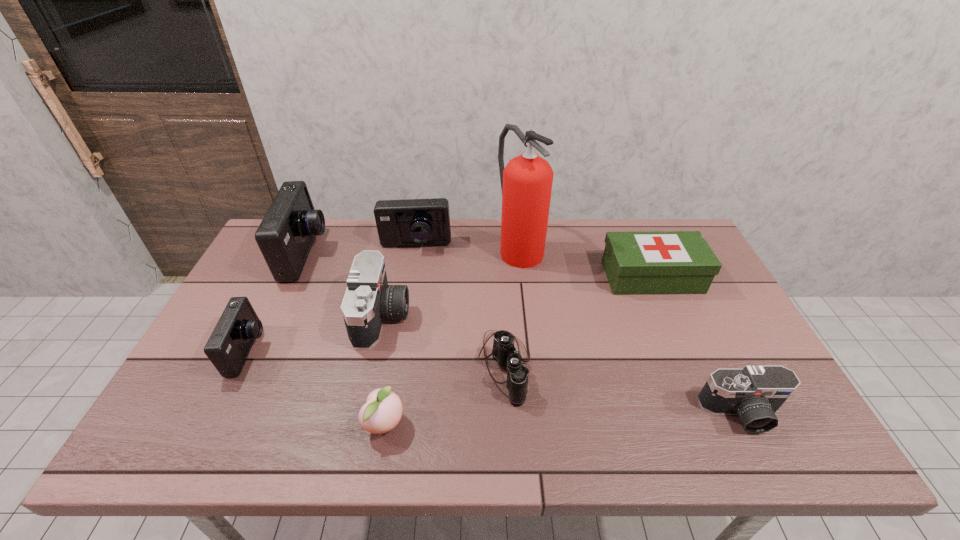
This screenshot has height=540, width=960. I want to click on free space located on the left of the pink peach, so click(x=325, y=423).

The height and width of the screenshot is (540, 960). What are the coordinates of `fire extinguisher that is at the far edge` in the screenshot? It's located at (526, 182).

At what (x,y) coordinates should I click in order to perform the action: click on the first-aid kit present at the far edge. Please return your answer as a coordinate pair (x, y). The width and height of the screenshot is (960, 540). Looking at the image, I should click on 657,262.

I want to click on camera that is at the near edge, so click(x=754, y=393).

This screenshot has width=960, height=540. In order to click on peach that is at the near edge in this screenshot , I will do `click(382, 411)`.

The width and height of the screenshot is (960, 540). What are the coordinates of `the first-aid kit present at the right edge` in the screenshot? It's located at (657, 262).

At what (x,y) coordinates should I click in order to perform the action: click on camera present at the right edge. Please return your answer as a coordinate pair (x, y). Looking at the image, I should click on click(x=754, y=393).

The width and height of the screenshot is (960, 540). I want to click on object that is at the far left corner, so point(285,236).

You are a GUI agent. You are given a task and a screenshot of the screen. Output one action in this format:
    pyautogui.click(x=<x>, y=<y>)
    Task: Click on the object that is at the far right corner
    This screenshot has width=960, height=540.
    Given the screenshot: What is the action you would take?
    pyautogui.click(x=657, y=262)

Identify the location of object situated at the near right corner. This screenshot has height=540, width=960. (754, 393).